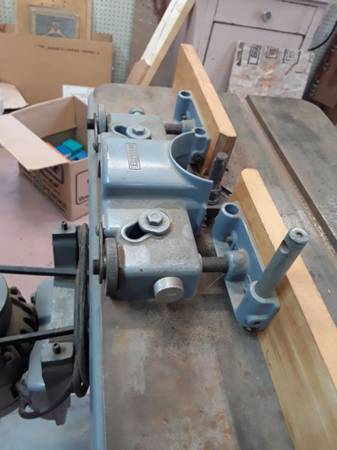
In order to click on drawer front in this screenshot , I will do `click(287, 22)`.